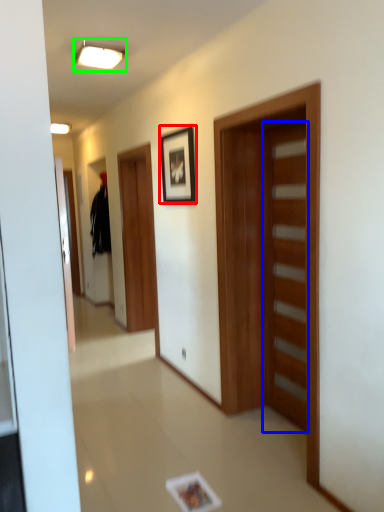
Question: Which object is the farthest from picture frame (highlighted by a red box)? Choose among these: door (highlighted by a blue box) or light fixture (highlighted by a green box).

Choices:
 (A) door
 (B) light fixture

Answer: (A)